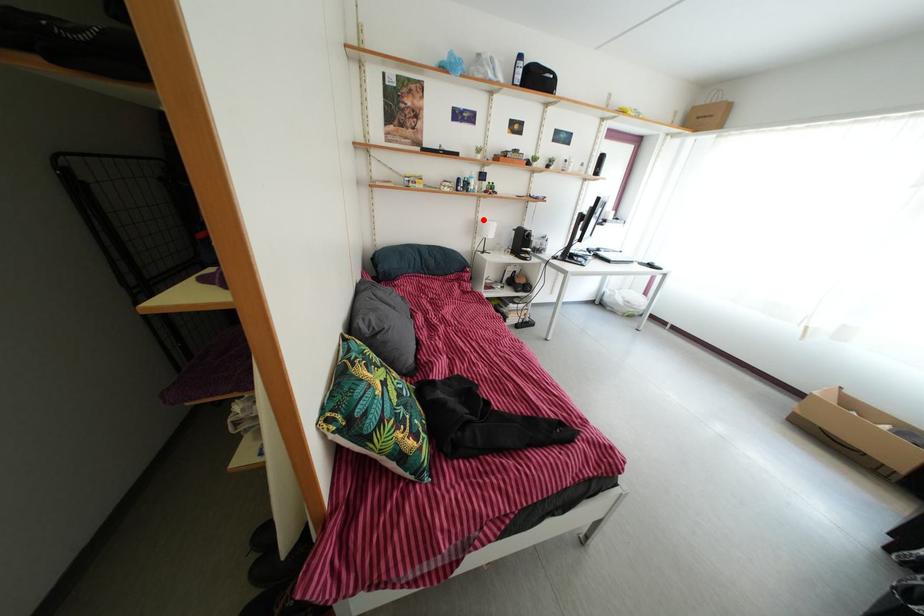
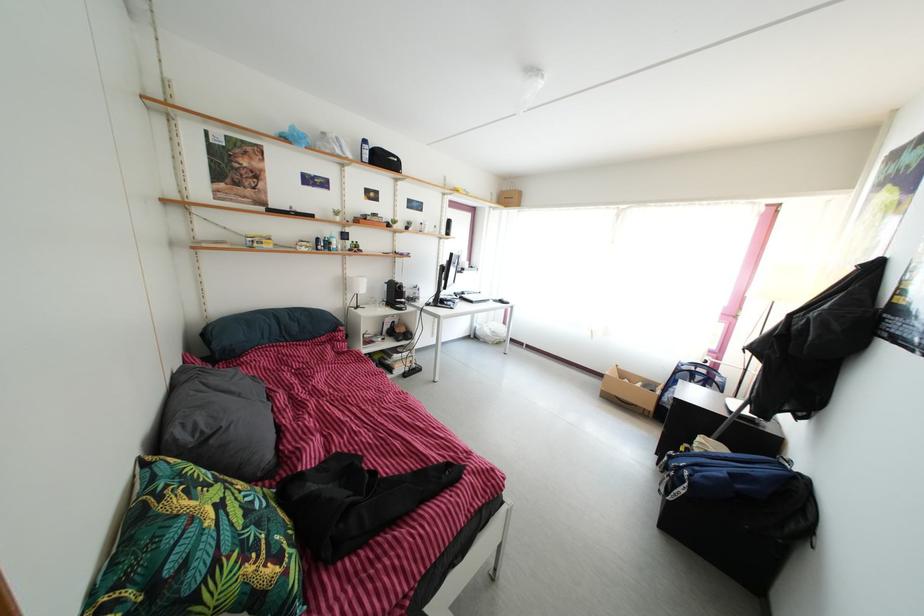
The point at the highlighted location is marked in the first image. Where is the corresponding point in the second image?

(350, 277)